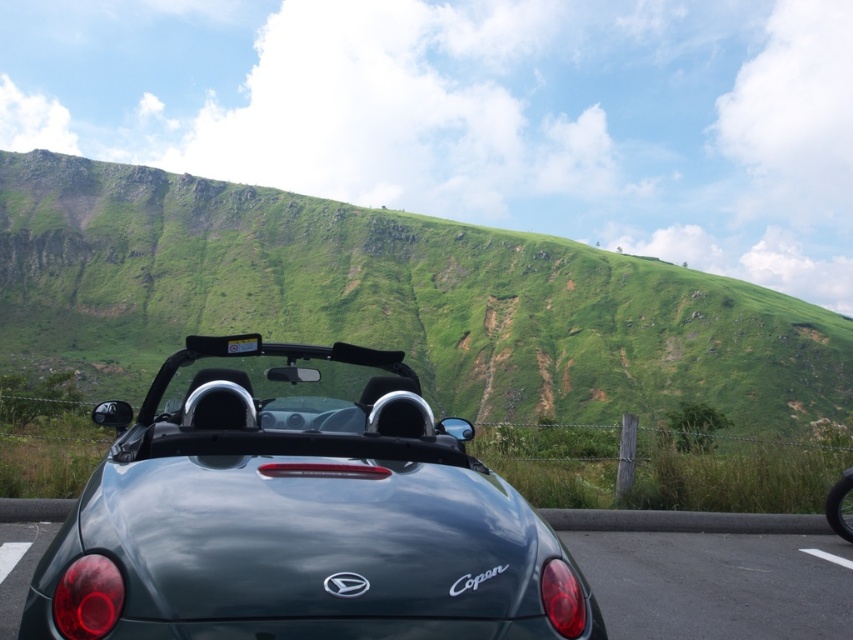
Does glossy dark green car at lower center appear on the right side of shiny black tire at lower right?

In fact, glossy dark green car at lower center is to the left of shiny black tire at lower right.

Who is taller, glossy dark green car at lower center or shiny black tire at lower right?

With more height is shiny black tire at lower right.

Measure the distance between point (738, 632) and camera.

A distance of 4.61 meters exists between point (738, 632) and camera.

Where is `glossy dark green car at lower center`? The width and height of the screenshot is (853, 640). glossy dark green car at lower center is located at coordinates (717, 584).

Is point (289, 224) closer to viewer compared to point (830, 486)?

No.

Based on the photo, does green grassy hillside at center appear on the right side of shiny black tire at lower right?

No, green grassy hillside at center is not to the right of shiny black tire at lower right.

The image size is (853, 640). Describe the element at coordinates (393, 300) in the screenshot. I see `green grassy hillside at center` at that location.

This screenshot has width=853, height=640. Identify the location of green grassy hillside at center. (393, 300).

What do you see at coordinates (393, 300) in the screenshot? I see `green grassy hillside at center` at bounding box center [393, 300].

Is green grassy hillside at center to the left of glossy dark green car at lower center from the viewer's perspective?

Correct, you'll find green grassy hillside at center to the left of glossy dark green car at lower center.

Consider the image. Who is more distant from viewer, (503, 301) or (579, 557)?

The point (503, 301) is more distant.

Where is `green grassy hillside at center`? The width and height of the screenshot is (853, 640). green grassy hillside at center is located at coordinates (393, 300).